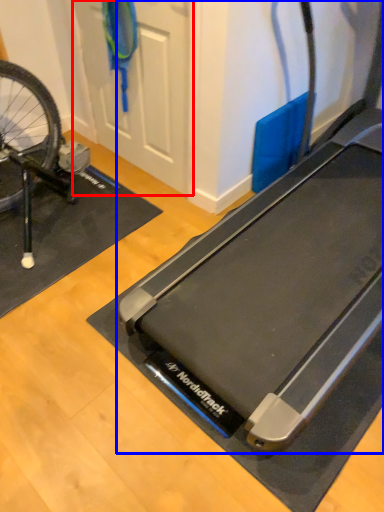
Question: Which object appears farthest to the camera in this image, door (highlighted by a red box) or treadmill (highlighted by a blue box)?

Choices:
 (A) door
 (B) treadmill

Answer: (A)